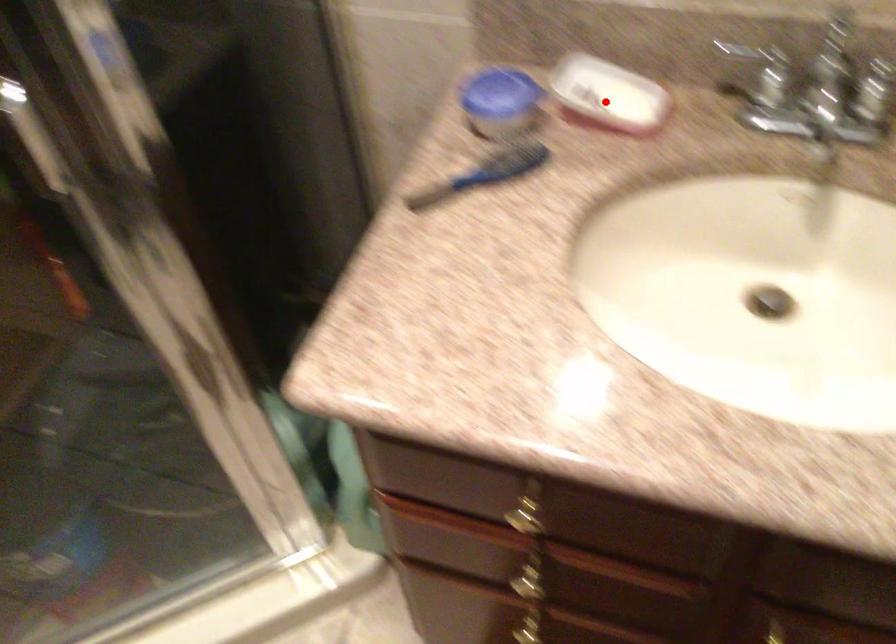
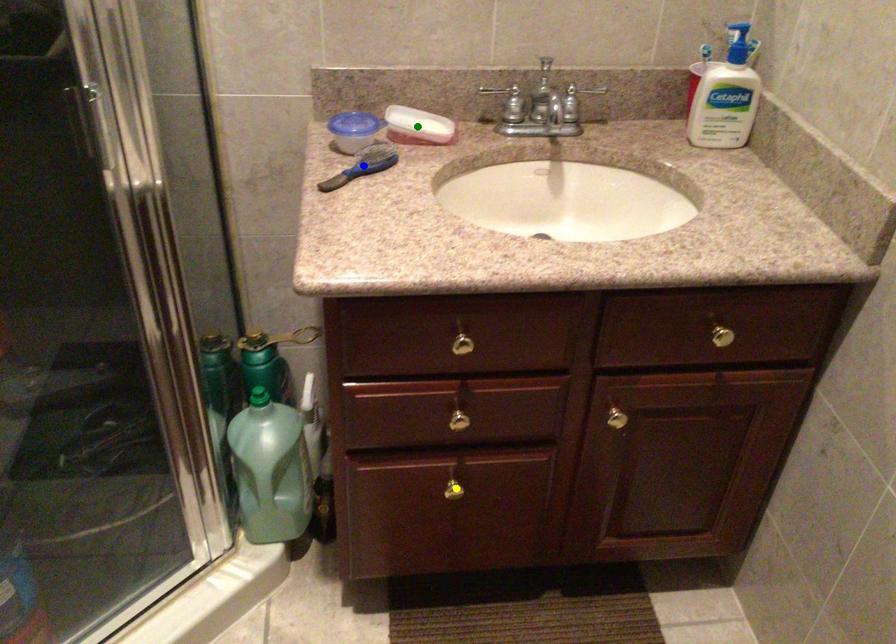
Question: I am providing you with two images of the same scene from different viewpoints. A red point is marked on the first image. You are given multiple points on the second image. Which spot in image 2 lines up with the point in image 1?

Choices:
 (A) blue point
 (B) green point
 (C) yellow point

Answer: (B)